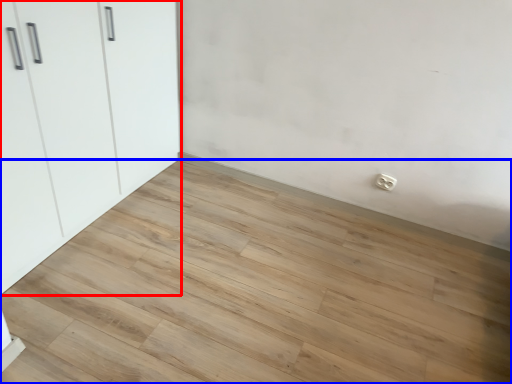
Question: Which object is further to the camera taking this photo, cupboard (highlighted by a red box) or plank (highlighted by a blue box)?

Choices:
 (A) cupboard
 (B) plank

Answer: (A)